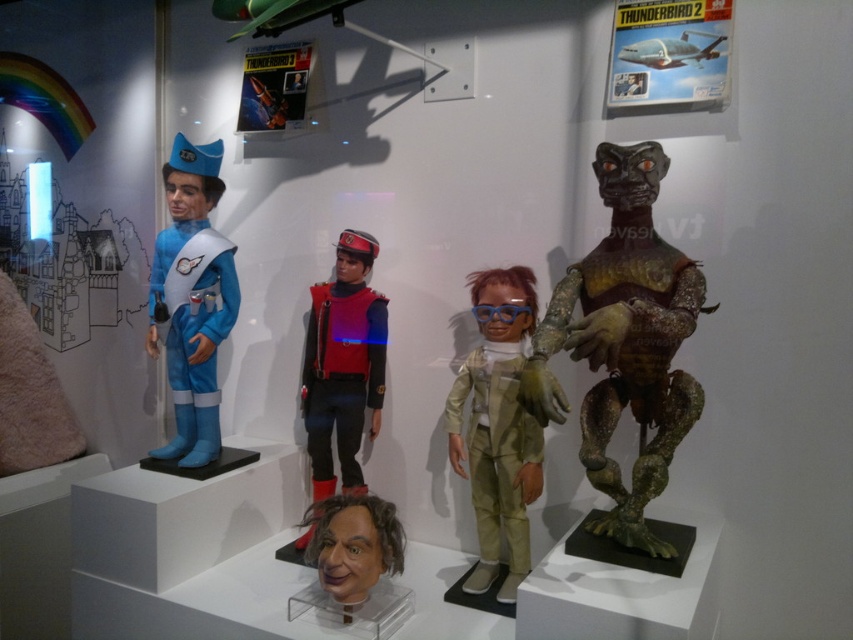
Question: Does shiny metallic alien at right appear on the right side of metallic silver airplane at upper center?

Choices:
 (A) yes
 (B) no

Answer: (B)

Question: Does light brown fabric doll at center appear on the right side of smooth plastic mask at center?

Choices:
 (A) no
 (B) yes

Answer: (B)

Question: Among these objects, which one is farthest from the camera?

Choices:
 (A) metallic silver airplane at upper center
 (B) matte blue plastic figure at left
 (C) smooth plastic mask at center
 (D) shiny metallic alien at right

Answer: (B)

Question: Which of the following is the closest to the observer?

Choices:
 (A) (381, 348)
 (B) (200, 147)
 (C) (689, 426)
 (D) (320, 609)

Answer: (C)

Question: Can you confirm if velvet-like red and blue uniform at center is positioned below metallic silver airplane at upper center?

Choices:
 (A) yes
 (B) no

Answer: (A)

Question: Estimate the real-world distances between objects in this image. Which object is farther from the smooth plastic mask at center?

Choices:
 (A) light brown fabric doll at center
 (B) metallic silver airplane at upper center
 (C) shiny metallic alien at right

Answer: (B)